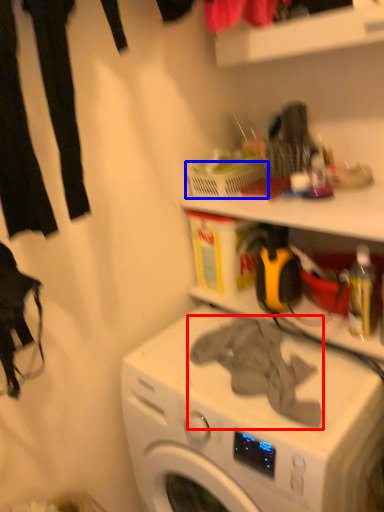
Question: Which of the following is the farthest to the observer, clothing (highlighted by a red box) or basket (highlighted by a blue box)?

Choices:
 (A) clothing
 (B) basket

Answer: (B)